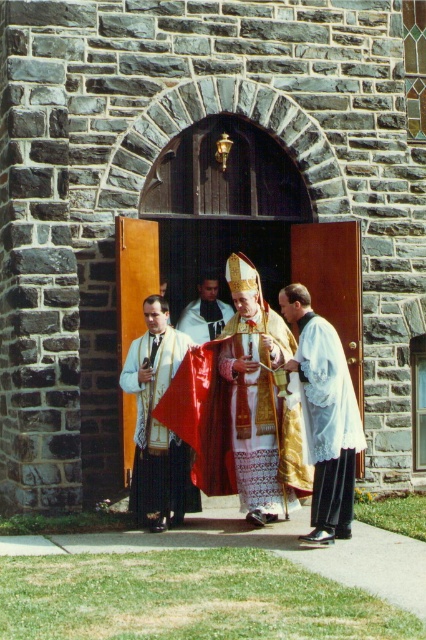
Question: Which of the following is the closest to the observer?

Choices:
 (A) white textured vestment at center
 (B) white lace robe at right

Answer: (B)

Question: In this image, where is white textured vestment at center located relative to white silk robe at center?

Choices:
 (A) below
 (B) above

Answer: (A)

Question: Which of these objects is positioned closest to the white silk robe at center?

Choices:
 (A) white textured vestment at center
 (B) white lace robe at right

Answer: (A)

Question: Is white lace robe at right to the left of white silk robe at center from the viewer's perspective?

Choices:
 (A) no
 (B) yes

Answer: (A)

Question: Among these objects, which one is farthest from the camera?

Choices:
 (A) white lace robe at right
 (B) gold embroidered vestment at center

Answer: (B)

Question: Is white textured vestment at center wider than white silk robe at center?

Choices:
 (A) no
 (B) yes

Answer: (B)